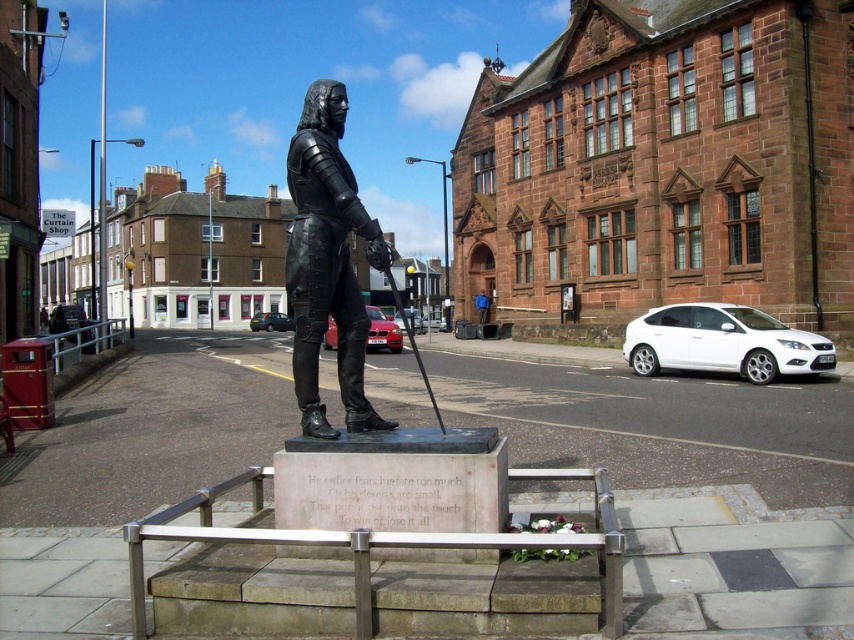
Question: Which point is closer to the camera?

Choices:
 (A) (338, 212)
 (B) (486, 298)

Answer: (A)

Question: Does black polished bronze statue at center appear on the right side of blue fabric jacket at center?

Choices:
 (A) yes
 (B) no

Answer: (B)

Question: Can you confirm if black polished bronze statue at center is positioned to the left of blue fabric jacket at center?

Choices:
 (A) no
 (B) yes

Answer: (B)

Question: Is black polished bronze statue at center bigger than blue fabric jacket at center?

Choices:
 (A) yes
 (B) no

Answer: (A)